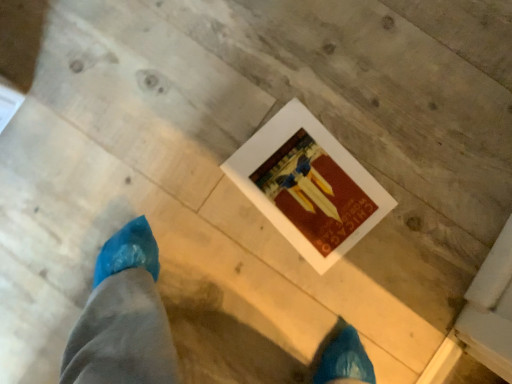
Where is `vacant point to the right of matte paper postcard at center`? The height and width of the screenshot is (384, 512). vacant point to the right of matte paper postcard at center is located at coordinates (409, 140).